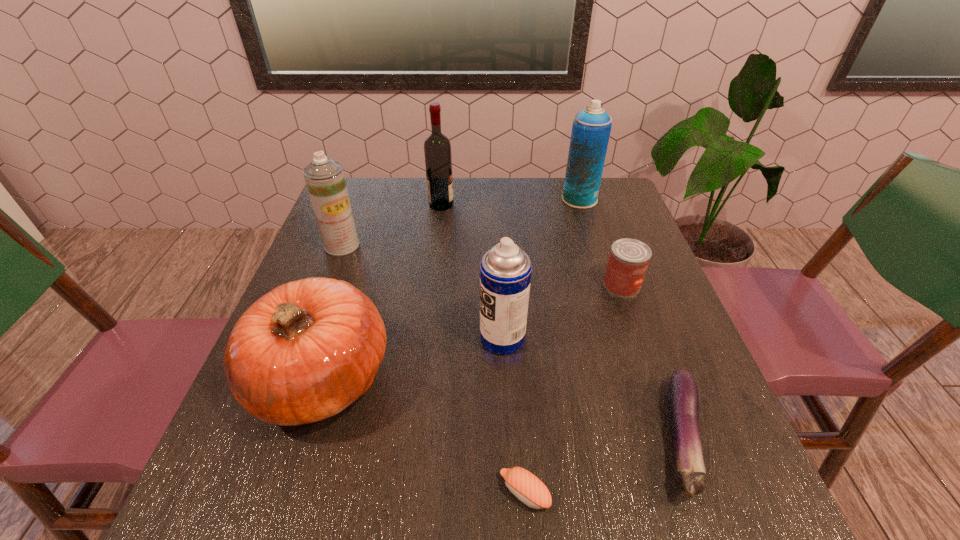
Where is `vacant space positioned 0.360m on the front and back of the alcohol`? Image resolution: width=960 pixels, height=540 pixels. vacant space positioned 0.360m on the front and back of the alcohol is located at coordinates (575, 205).

This screenshot has width=960, height=540. Identify the location of free space located on the right of the rightmost aerosol can. (x=620, y=199).

You are a GUI agent. You are given a task and a screenshot of the screen. Output one action in this format:
    pyautogui.click(x=<x>, y=<y>)
    Task: Click on the vacant region located on the back of the second nearest aerosol can
    
    Given the screenshot: What is the action you would take?
    pyautogui.click(x=359, y=201)

The image size is (960, 540). What are the coordinates of `free spot located on the label side of the second aerosol can from right to left` in the screenshot? It's located at (423, 338).

This screenshot has height=540, width=960. I want to click on free region located on the label side of the second aerosol can from right to left, so click(x=295, y=338).

This screenshot has width=960, height=540. I want to click on free region located on the label side of the second aerosol can from right to left, so click(347, 338).

Where is `vacant region located 0.230m on the back of the pumpkin`? This screenshot has width=960, height=540. vacant region located 0.230m on the back of the pumpkin is located at coordinates (360, 257).

Locate an element on the screen. The image size is (960, 540). free location located on the left of the fourth farthest object is located at coordinates (574, 285).

Locate an element on the screen. vacant space situated 0.100m on the left of the second shortest object is located at coordinates (597, 438).

You are a GUI agent. You are given a task and a screenshot of the screen. Output one action in this format:
    pyautogui.click(x=<x>, y=<y>)
    Task: Click on the blank area located 0.200m on the back of the sushi
    This screenshot has height=540, width=960.
    Given the screenshot: What is the action you would take?
    pyautogui.click(x=516, y=371)